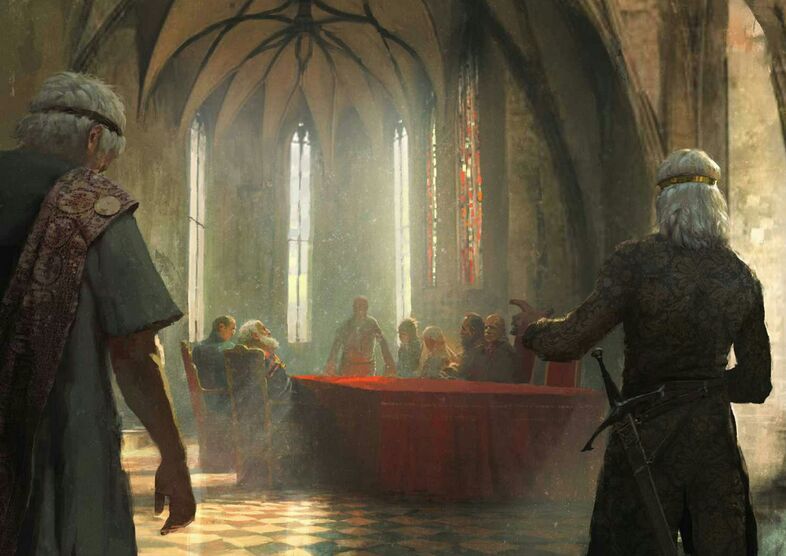
Find the location of a particular element. This screenshot has height=556, width=786. tablecloth is located at coordinates (465, 435).